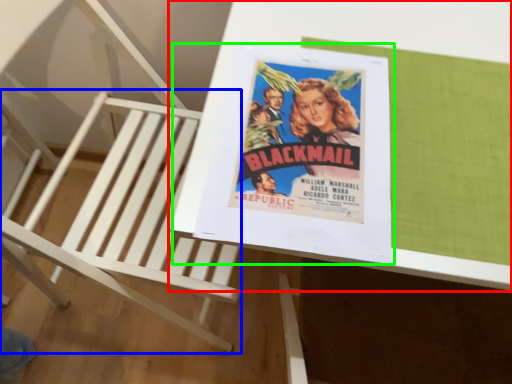
Question: Based on their relative distances, which object is farther from table (highlighted by a red box)? Choose from furniture (highlighted by a blue box) and paperback book (highlighted by a green box).

Choices:
 (A) furniture
 (B) paperback book

Answer: (A)